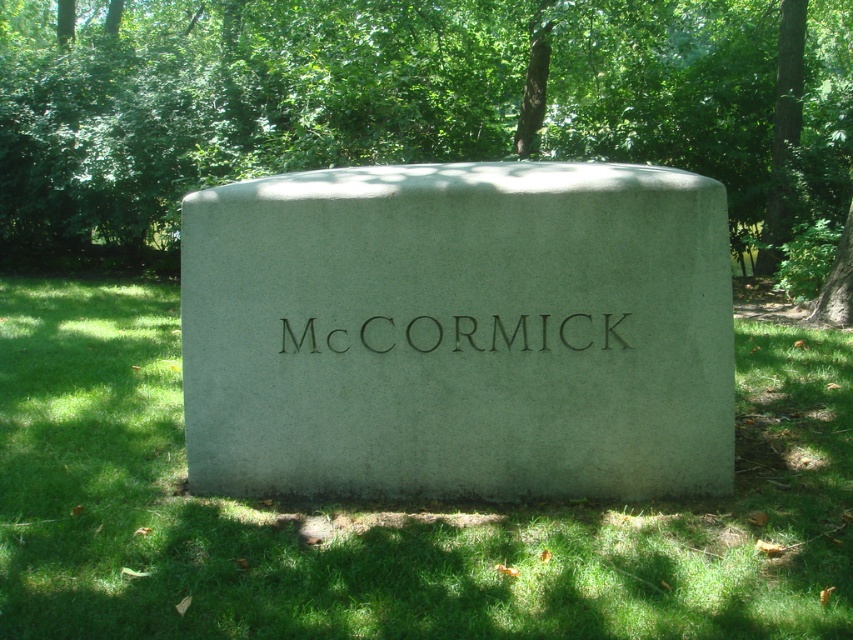
You are standing in front of the monument and want to take a photo of the green leafy tree at center and the green grass at center. Which object will appear closer to you in the photo?

The green leafy tree at center will appear closer to you in the photo because the green grass at center is behind it.